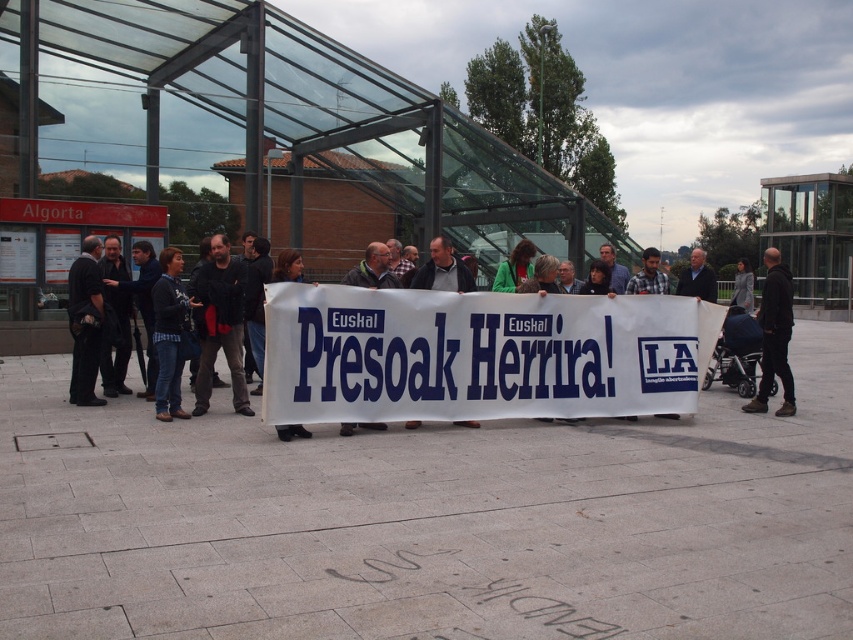
Between white fabric banner at center and matte black banner at center, which one has less height?

matte black banner at center is shorter.

How much distance is there between white fabric banner at center and matte black banner at center?

They are 4.68 feet apart.

Between point (444, 289) and point (296, 256), which one is positioned behind?

The point (444, 289) is behind.

Locate an element on the screen. white fabric banner at center is located at coordinates (444, 269).

Identify the location of dark blue jeans at center. The height and width of the screenshot is (640, 853). (477, 355).

Is point (451, 294) in front of point (380, 248)?

That is False.

Where is `dark blue jeans at center`? dark blue jeans at center is located at coordinates (477, 355).

Which of these two, blue denim jeans at center or white fabric banner at center, stands taller?

blue denim jeans at center

Consider the image. Can you confirm if blue denim jeans at center is positioned above white fabric banner at center?

No, blue denim jeans at center is not above white fabric banner at center.

Who is more forward, (158, 406) or (428, 243)?

Positioned in front is point (158, 406).

The image size is (853, 640). I want to click on blue denim jeans at center, so click(x=169, y=333).